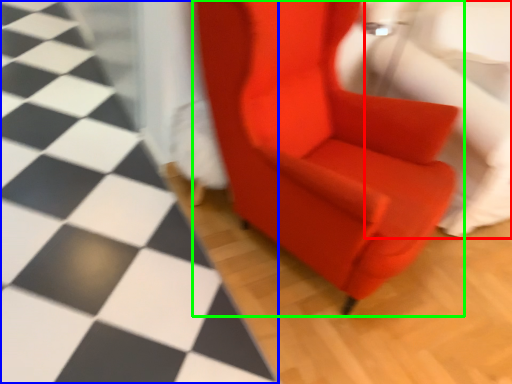
Question: Considering the real-world distances, which object is farthest from swivel chair (highlighted by a red box)? tile (highlighted by a blue box) or chair (highlighted by a green box)?

Choices:
 (A) tile
 (B) chair

Answer: (A)